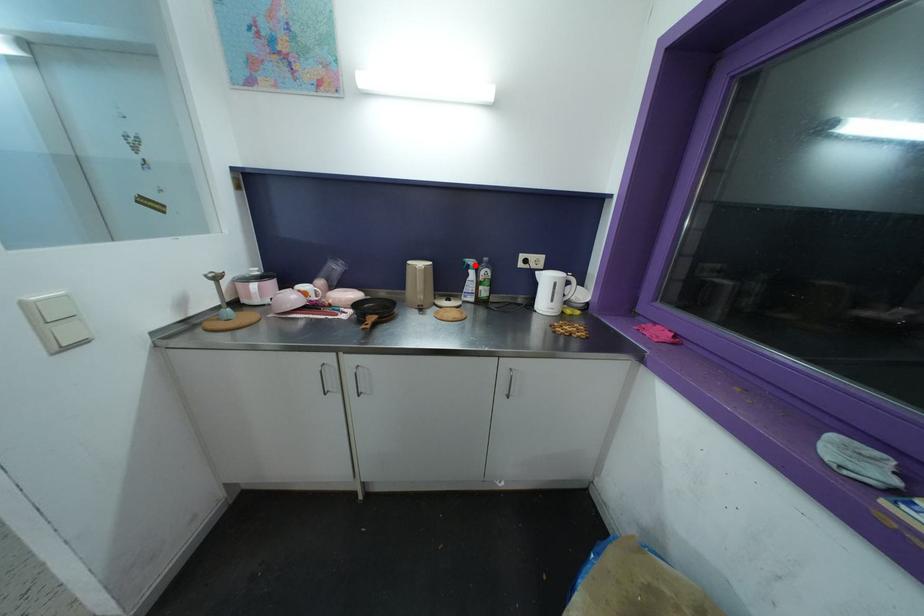
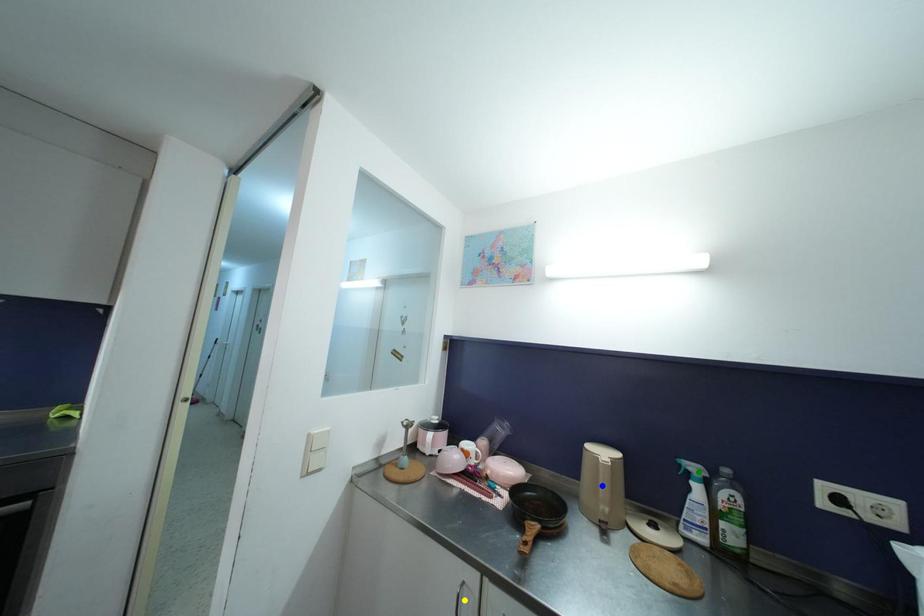
Question: I am providing you with two images of the same scene from different viewpoints. A red point is marked on the first image. You are given multiple points on the second image. Which point in image 2 represents the same 3d spot as the red point in image 1?

Choices:
 (A) green point
 (B) yellow point
 (C) blue point

Answer: (A)